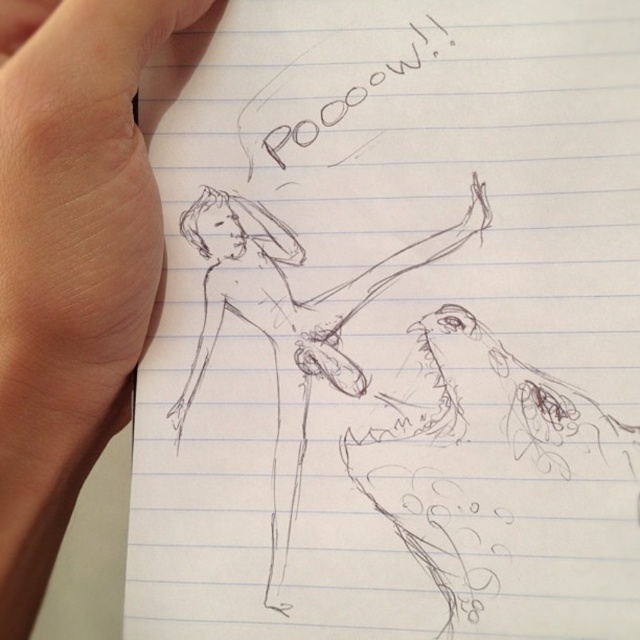
Question: Does black sketch figure at center appear under skinny flesh at upper left?

Choices:
 (A) no
 (B) yes

Answer: (B)

Question: Is the position of black sketch figure at center less distant than that of skinny flesh at upper left?

Choices:
 (A) no
 (B) yes

Answer: (A)

Question: Which point is closer to the camera?

Choices:
 (A) black sketch figure at center
 (B) skinny flesh at upper left

Answer: (B)

Question: Which object is closer to the camera taking this photo?

Choices:
 (A) black sketch figure at center
 (B) skinny flesh at upper left

Answer: (B)

Question: Which of the following is the closest to the observer?

Choices:
 (A) black sketch figure at center
 (B) skinny flesh at upper left

Answer: (B)

Question: Does black sketch figure at center appear on the right side of skinny flesh at upper left?

Choices:
 (A) yes
 (B) no

Answer: (A)